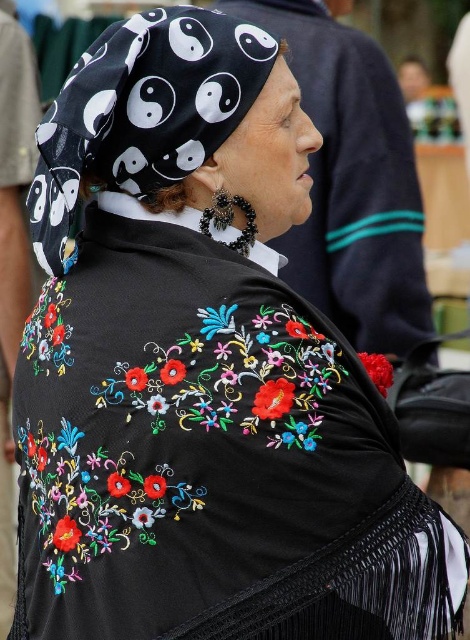
Image resolution: width=470 pixels, height=640 pixels. Describe the element at coordinates (352, 180) in the screenshot. I see `black embroidered poncho at center` at that location.

Between black embroidered poncho at center and black printed fabric headscarf at upper left, which one appears on the left side from the viewer's perspective?

black printed fabric headscarf at upper left is more to the left.

The image size is (470, 640). I want to click on black embroidered poncho at center, so click(352, 180).